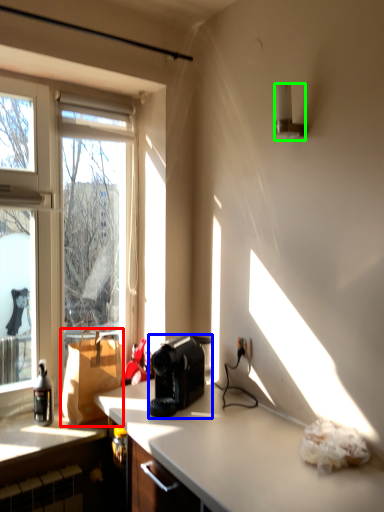
Question: Which is farther away from cardboard box (highlighted by a red box)? coffee maker (highlighted by a blue box) or lamp (highlighted by a green box)?

Choices:
 (A) coffee maker
 (B) lamp

Answer: (B)